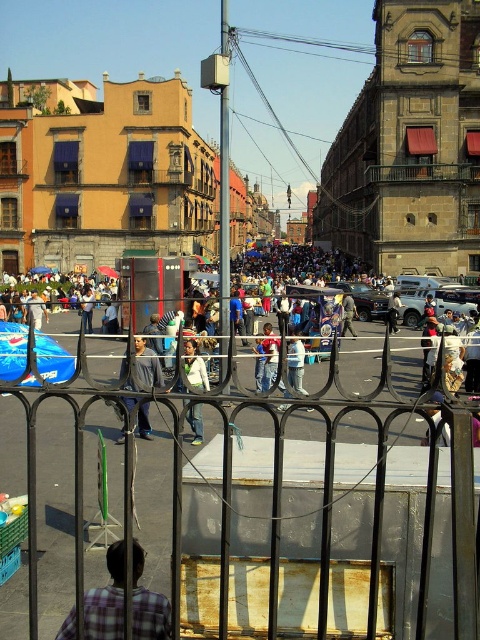
You are a delivery person needing to navigate through the crowd in the busy street. You see a denim pants at center and a light brown leather jacket at center. Can you estimate if the space between them is enough to pass through with your 1.2 meter wide delivery cart?

The distance between denim pants at center and light brown leather jacket at center is 27.51 meters, which is more than enough space for a 1.2 meter wide delivery cart to pass through safely.

You are a photographer standing in the crowd and want to take a photo of the light gray shirt at center and the light brown leather jacket at center. Can you fit both subjects in the frame if your camera has a 5 meter minimum distance requirement?

The light gray shirt at center is 4.95 meters from the light brown leather jacket at center, so yes, both subjects can be captured in the frame since the distance between them is just under the 5 meter requirement.

You are a delivery person with a cart that is 1.5 meters wide. You need to navigate through the street in the image. The black wrought iron fence at center is in your path. Can you pass through the opening in the fence without going around it?

The black wrought iron fence at center is 24.88 meters from viewer, so the distance is sufficient to maneuver the cart through the opening. Yes, you can pass through the opening in the black wrought iron fence at center without needing to go around it.